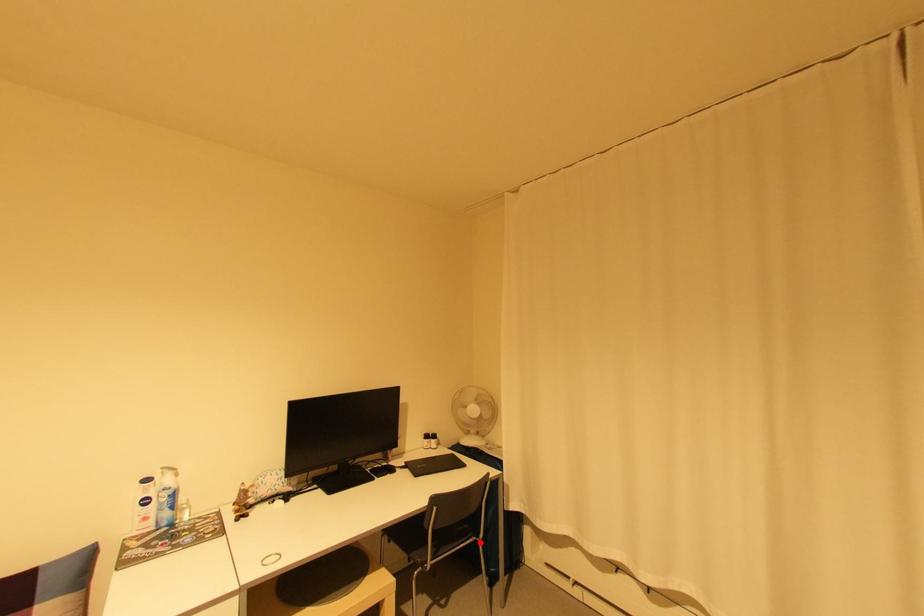
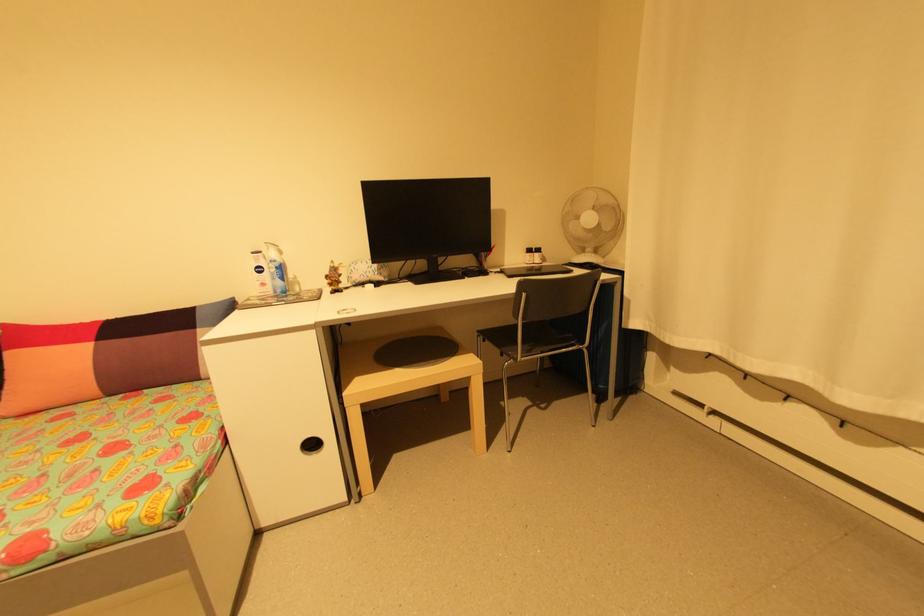
Question: A red point is marked in image1. In image2, is the corresponding 3D point closer to the camera or farther? Reply with the corresponding letter.

Choices:
 (A) The corresponding 3D point is closer.
 (B) The corresponding 3D point is farther.

Answer: (A)